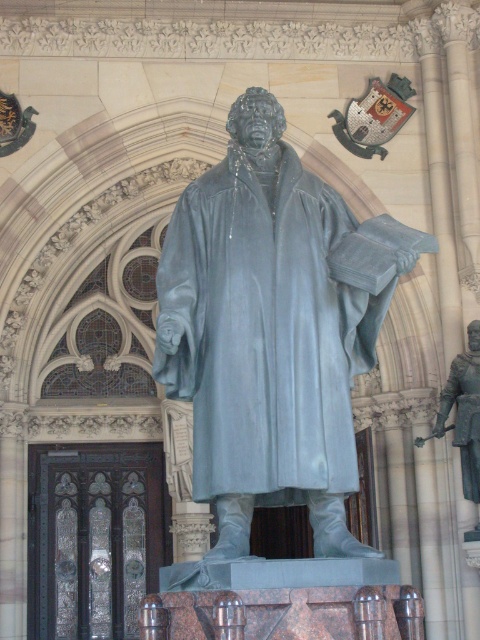
Which of these two, matte gray statue at center or polished bronze knight at right, stands shorter?

polished bronze knight at right is shorter.

Is matte gray statue at center smaller than polished bronze knight at right?

Incorrect, matte gray statue at center is not smaller in size than polished bronze knight at right.

Between point (280, 186) and point (479, 470), which one is positioned in front?

Positioned in front is point (280, 186).

Locate an element on the screen. matte gray statue at center is located at coordinates (265, 333).